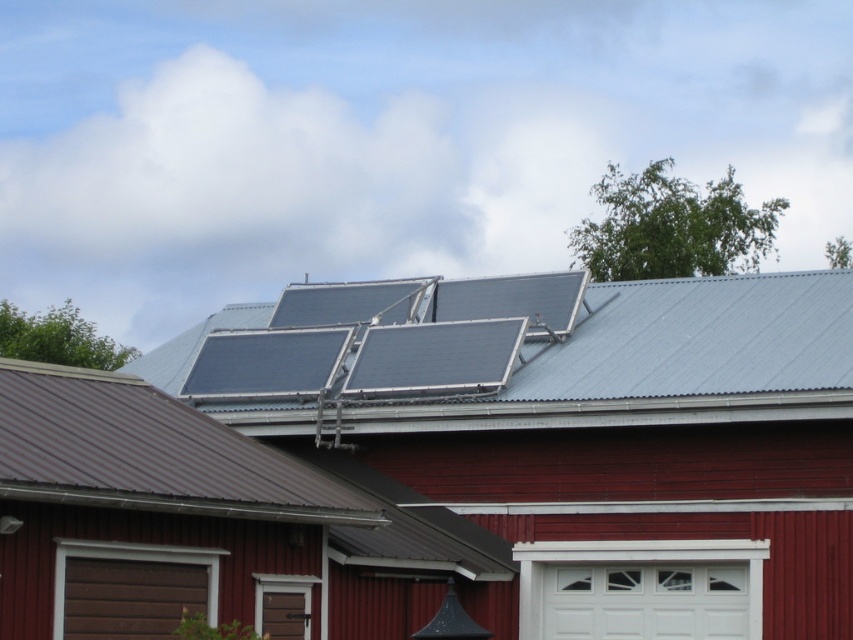
Which is below, metallic red barn at center or blue metallic solar panels at center?

metallic red barn at center is lower down.

Is metallic red barn at center behind blue metallic solar panels at center?

No, metallic red barn at center is in front of blue metallic solar panels at center.

I want to click on metallic red barn at center, so click(x=447, y=465).

Does metallic red barn at center lie in front of white matte/glossy garage door at lower center?

That is True.

Can you confirm if metallic red barn at center is smaller than white matte/glossy garage door at lower center?

No.

Based on the photo, who is more forward, (x=70, y=620) or (x=566, y=600)?

Point (x=70, y=620) is in front.

Locate an element on the screen. This screenshot has height=640, width=853. metallic red barn at center is located at coordinates (447, 465).

Is blue metallic solar panels at center above white matte/glossy garage door at lower center?

Yes, blue metallic solar panels at center is above white matte/glossy garage door at lower center.

Who is higher up, blue metallic solar panels at center or white matte/glossy garage door at lower center?

blue metallic solar panels at center

Is point (630, 291) closer to viewer compared to point (631, 579)?

That is False.

This screenshot has height=640, width=853. I want to click on blue metallic solar panels at center, so (700, 339).